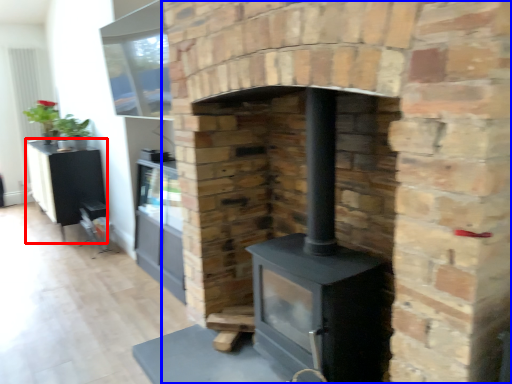
Question: Which object appears closest to the camera in this image, entertainment center (highlighted by a red box) or fireplace (highlighted by a blue box)?

Choices:
 (A) entertainment center
 (B) fireplace

Answer: (B)